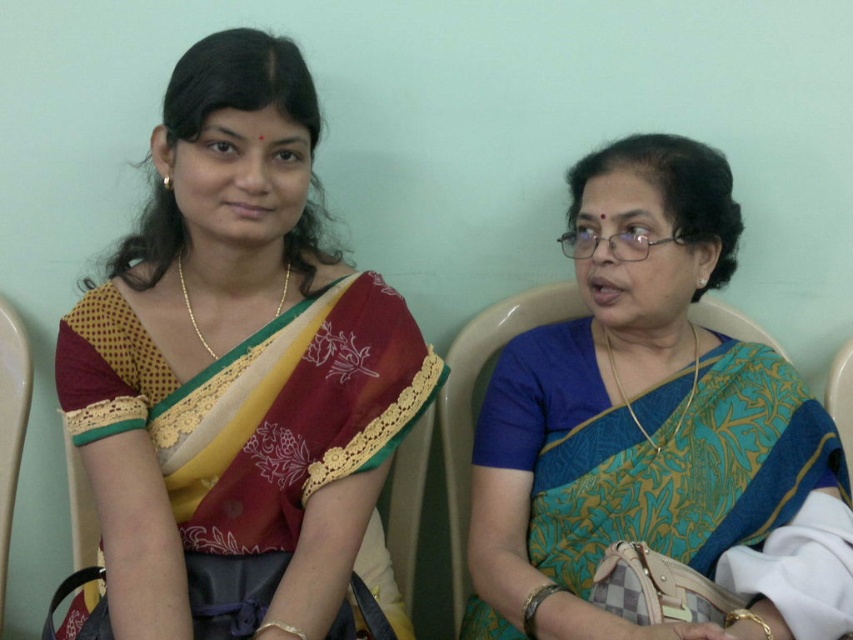
You are a tailor who needs to determine which saree requires more fabric for alterations. Based on the image, which saree between the matte silk saree at left and the blue silk saree at right has a greater width?

The blue silk saree at right has a greater width compared to the matte silk saree at left, so it requires more fabric for alterations.

You are a photographer who wants to capture the blue silk saree at right in the image. Where should you focus your camera to ensure it is centered in the frame?

You should focus your camera at point (x=653, y=428) to center the blue silk saree at right in the frame.

You are a photographer setting up a shoot. You need to place a small stool between the two women so that it is closer to the matte silk saree at left than to the blue silk saree at right. Where should you position the stool?

The stool should be placed closer to the matte silk saree at left, between the two women, since the matte silk saree at left is positioned on the left side of the blue silk saree at right.